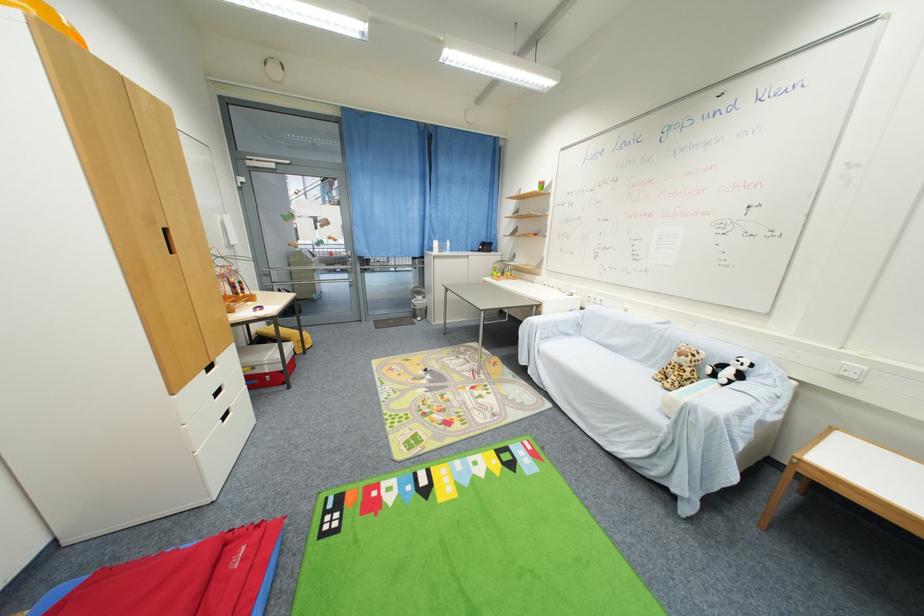
Where would you lift the green cup? Please return your answer as a coordinate pair (x, y).

(541, 185)